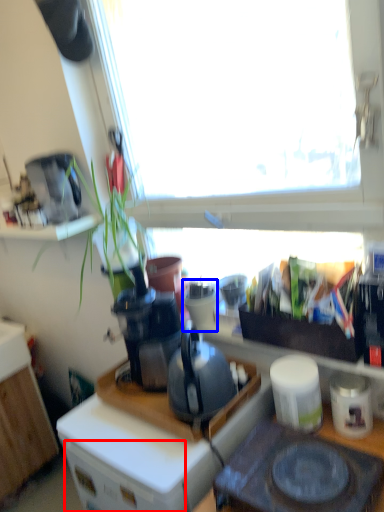
Question: Which object appears closest to the camera in this image, drawer (highlighted by a red box) or appliance (highlighted by a blue box)?

Choices:
 (A) drawer
 (B) appliance

Answer: (A)